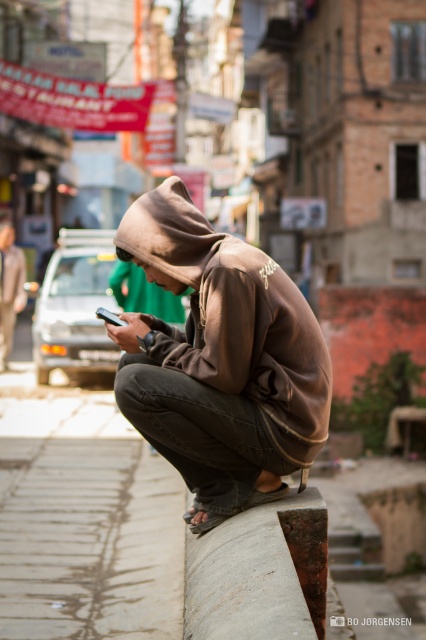
Between brown matte hoodie at center and rusty metal curb at lower center, which one is positioned lower?

Positioned lower is rusty metal curb at lower center.

Does brown matte hoodie at center have a smaller size compared to rusty metal curb at lower center?

Actually, brown matte hoodie at center might be larger than rusty metal curb at lower center.

Image resolution: width=426 pixels, height=640 pixels. Find the location of `brown matte hoodie at center`. brown matte hoodie at center is located at coordinates (219, 360).

Does rusty metal curb at lower center appear under brown cotton hoodie at center?

Correct, rusty metal curb at lower center is located below brown cotton hoodie at center.

Can you confirm if rusty metal curb at lower center is shorter than brown cotton hoodie at center?

Yes.

This screenshot has height=640, width=426. Identify the location of rusty metal curb at lower center. (259, 573).

Is smooth concrete pavement at lower center bigger than brown cotton hoodie at center?

Yes, smooth concrete pavement at lower center is bigger than brown cotton hoodie at center.

Which is in front, point (66, 529) or point (8, 307)?

Point (66, 529) is in front.

Is point (95, 440) positioned in front of point (25, 300)?

Yes.

You are a GUI agent. You are given a task and a screenshot of the screen. Output one action in this format:
    pyautogui.click(x=<x>, y=<y>)
    Task: Click on the smooth concrete pavement at lower center
    The width and height of the screenshot is (426, 640).
    Given the screenshot: What is the action you would take?
    pyautogui.click(x=85, y=520)